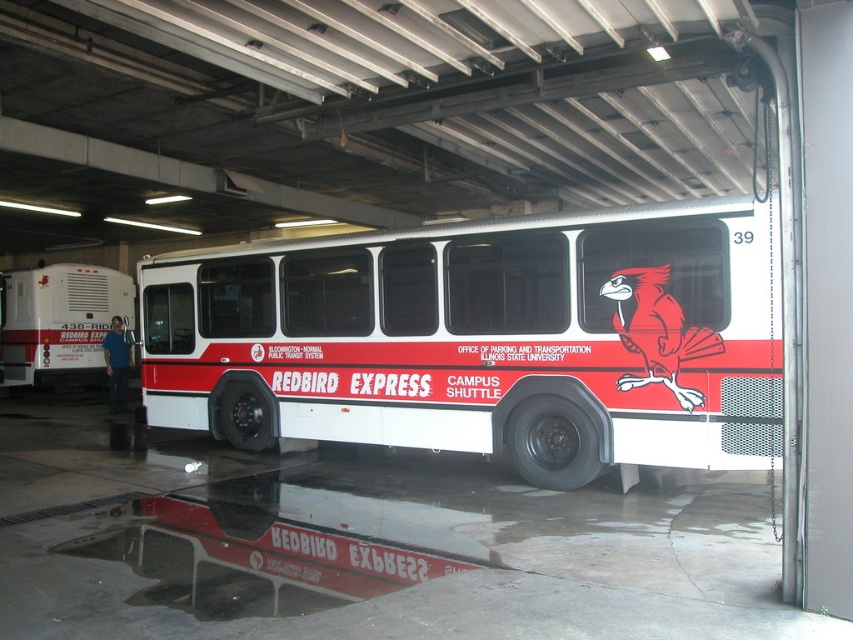
You are standing inside the garage where the Redbird Express Campus Shuttle is parked. You notice two points marked on the side of the bus. The first point is at coordinate (747,410) and the second is at (94,269). From your perspective, which point is closer to the front of the bus?

Point (747,410) is in front of point (94,269), so the first point is closer to the front of the bus.

You are a delivery person who needs to load a package onto the trailer. The package requires a minimum height clearance of 2 meters. You see the white matte bus at center and the white matte trailer at left. Which one has enough vertical space to accommodate the package?

The white matte trailer at left is taller than the white matte bus at center, so the white matte trailer at left has enough vertical space to accommodate the package with the required 2 meters height clearance.

From the picture: You are a delivery person who needs to park a white matte trailer at left and a white matte bus at center in a narrow alley. The alley can only accommodate one vehicle at a time. Which vehicle should you park first to ensure the other can fit afterward?

The white matte bus at center is smaller than the white matte trailer at left. You should park the white matte trailer at left first, then the white matte bus at center will fit behind it in the alley.